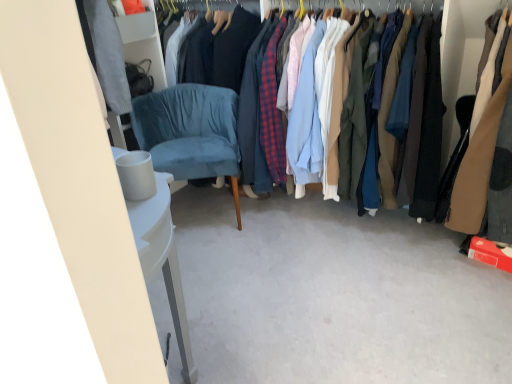
The height and width of the screenshot is (384, 512). What do you see at coordinates (426, 133) in the screenshot?
I see `matte cotton shirts at center, arranged as the 1th clothing when viewed from the left` at bounding box center [426, 133].

Describe the element at coordinates (190, 132) in the screenshot. I see `velvet blue armchair at center-left` at that location.

You are a GUI agent. You are given a task and a screenshot of the screen. Output one action in this format:
    pyautogui.click(x=<x>, y=<y>)
    Task: Click on the white matte trash bin at lower left
    
    Given the screenshot: What is the action you would take?
    pyautogui.click(x=135, y=174)

In the scene shown: Is matte cotton shirts at center, arranged as the 1th clothing when viewed from the left, in front of or behind white matte trash bin at lower left in the image?

Clearly, matte cotton shirts at center, arranged as the 1th clothing when viewed from the left, is behind white matte trash bin at lower left.

This screenshot has width=512, height=384. I want to click on clothing that is the 2nd object directly below the white matte trash bin at lower left (from a real-world perspective), so [x=426, y=133].

Considering the relative sizes of matte cotton shirts at center, which is counted as the 2th clothing, starting from the right, and white matte trash bin at lower left in the image provided, is matte cotton shirts at center, which is counted as the 2th clothing, starting from the right, shorter than white matte trash bin at lower left?

No.

Between velvet blue armchair at center-left and white matte trash bin at lower left, which one has smaller width?

white matte trash bin at lower left.

Is velvet blue armchair at center-left positioned with its back to white matte trash bin at lower left?

No, velvet blue armchair at center-left's orientation is not away from white matte trash bin at lower left.

Is point (234, 125) positioned before point (129, 153)?

No, it is behind (129, 153).

Would you say velvet blue armchair at center-left is to the left or to the right of white matte trash bin at lower left in the picture?

Clearly, velvet blue armchair at center-left is on the left of white matte trash bin at lower left in the image.

Is point (126, 184) closer or farther from the camera than point (237, 218)?

Clearly, point (126, 184) is closer to the camera than point (237, 218).

Considering the sizes of objects white matte trash bin at lower left and velvet blue armchair at center-left in the image provided, who is taller, white matte trash bin at lower left or velvet blue armchair at center-left?

With more height is velvet blue armchair at center-left.

Identify the location of trash bin/can above the brown leather jacket at right, the second clothing viewed from the left (from a real-world perspective). Image resolution: width=512 pixels, height=384 pixels. (135, 174).

Is brown leather jacket at right, which appears as the first clothing when viewed from the right, surrounding white matte trash bin at lower left?

That's incorrect, white matte trash bin at lower left is not inside brown leather jacket at right, which appears as the first clothing when viewed from the right.

In terms of height, does brown leather jacket at right, which appears as the first clothing when viewed from the right, look taller or shorter compared to white matte trash bin at lower left?

brown leather jacket at right, which appears as the first clothing when viewed from the right, is taller than white matte trash bin at lower left.

Is matte cotton shirts at center, arranged as the 1th clothing when viewed from the left, situated inside velvet blue armchair at center-left or outside?

matte cotton shirts at center, arranged as the 1th clothing when viewed from the left, is not inside velvet blue armchair at center-left, it's outside.

Is matte cotton shirts at center, arranged as the 1th clothing when viewed from the left, bigger than velvet blue armchair at center-left?

Answer: Yes.

Considering the relative sizes of matte cotton shirts at center, arranged as the 1th clothing when viewed from the left, and velvet blue armchair at center-left in the image provided, is matte cotton shirts at center, arranged as the 1th clothing when viewed from the left, thinner than velvet blue armchair at center-left?

In fact, matte cotton shirts at center, arranged as the 1th clothing when viewed from the left, might be wider than velvet blue armchair at center-left.

Can you confirm if velvet blue armchair at center-left is bigger than brown leather jacket at right, the second clothing viewed from the left?

No.

Who is shorter, velvet blue armchair at center-left or brown leather jacket at right, the second clothing viewed from the left?

velvet blue armchair at center-left.

In the scene shown: Can you confirm if velvet blue armchair at center-left is wider than brown leather jacket at right, which appears as the first clothing when viewed from the right?

No.

What are the coordinates of `clothing located on the right of matte cotton shirts at center, which is counted as the 2th clothing, starting from the right` in the screenshot? It's located at (x=479, y=147).

Considering the sizes of brown leather jacket at right, which appears as the first clothing when viewed from the right, and matte cotton shirts at center, arranged as the 1th clothing when viewed from the left, in the image, is brown leather jacket at right, which appears as the first clothing when viewed from the right, wider or thinner than matte cotton shirts at center, arranged as the 1th clothing when viewed from the left,?

Clearly, brown leather jacket at right, which appears as the first clothing when viewed from the right, has more width compared to matte cotton shirts at center, arranged as the 1th clothing when viewed from the left.

From a real-world perspective, who is located higher, brown leather jacket at right, which appears as the first clothing when viewed from the right, or matte cotton shirts at center, which is counted as the 2th clothing, starting from the right?

From a 3D spatial view, brown leather jacket at right, which appears as the first clothing when viewed from the right, is above.

Consider the image. How much distance is there between brown leather jacket at right, the second clothing viewed from the left, and matte cotton shirts at center, which is counted as the 2th clothing, starting from the right?

brown leather jacket at right, the second clothing viewed from the left, is 8.52 inches from matte cotton shirts at center, which is counted as the 2th clothing, starting from the right.

The height and width of the screenshot is (384, 512). Identify the location of trash bin/can lying in front of the matte cotton shirts at center, which is counted as the 2th clothing, starting from the right. (135, 174).

Identify the location of trash bin/can lying below the velvet blue armchair at center-left (from the image's perspective). This screenshot has width=512, height=384. (135, 174).

Looking at the image, which one is located further to velvet blue armchair at center-left, matte cotton shirts at center, arranged as the 1th clothing when viewed from the left, or brown leather jacket at right, the second clothing viewed from the left?

Based on the image, brown leather jacket at right, the second clothing viewed from the left, appears to be further to velvet blue armchair at center-left.

From the image, which object appears to be nearer to matte cotton shirts at center, arranged as the 1th clothing when viewed from the left, white matte trash bin at lower left or velvet blue armchair at center-left?

velvet blue armchair at center-left is closer to matte cotton shirts at center, arranged as the 1th clothing when viewed from the left.

Looking at the image, which one is located further to matte cotton shirts at center, which is counted as the 2th clothing, starting from the right, velvet blue armchair at center-left or white matte trash bin at lower left?

white matte trash bin at lower left.

From the image, which object appears to be nearer to brown leather jacket at right, which appears as the first clothing when viewed from the right, velvet blue armchair at center-left or matte cotton shirts at center, which is counted as the 2th clothing, starting from the right?

matte cotton shirts at center, which is counted as the 2th clothing, starting from the right, is closer to brown leather jacket at right, which appears as the first clothing when viewed from the right.

Estimate the real-world distances between objects in this image. Which object is further from white matte trash bin at lower left, matte cotton shirts at center, which is counted as the 2th clothing, starting from the right, or brown leather jacket at right, the second clothing viewed from the left?

matte cotton shirts at center, which is counted as the 2th clothing, starting from the right, lies further to white matte trash bin at lower left than the other object.

Based on the photo, estimate the real-world distances between objects in this image. Which object is closer to white matte trash bin at lower left, velvet blue armchair at center-left or matte cotton shirts at center, which is counted as the 2th clothing, starting from the right?

velvet blue armchair at center-left is positioned closer to the anchor white matte trash bin at lower left.

Based on their spatial positions, is matte cotton shirts at center, arranged as the 1th clothing when viewed from the left, or white matte trash bin at lower left closer to velvet blue armchair at center-left?

The object closer to velvet blue armchair at center-left is matte cotton shirts at center, arranged as the 1th clothing when viewed from the left.

Which object lies further to the anchor point matte cotton shirts at center, which is counted as the 2th clothing, starting from the right, brown leather jacket at right, which appears as the first clothing when viewed from the right, or velvet blue armchair at center-left?

velvet blue armchair at center-left.

Find the location of a particular element. This screenshot has height=384, width=512. trash bin/can situated between velvet blue armchair at center-left and brown leather jacket at right, which appears as the first clothing when viewed from the right, from left to right is located at coordinates (135, 174).

Image resolution: width=512 pixels, height=384 pixels. In order to click on clothing between velvet blue armchair at center-left and brown leather jacket at right, which appears as the first clothing when viewed from the right, in the horizontal direction in this screenshot , I will do `click(426, 133)`.

This screenshot has height=384, width=512. I want to click on clothing between white matte trash bin at lower left and brown leather jacket at right, the second clothing viewed from the left, so click(x=426, y=133).